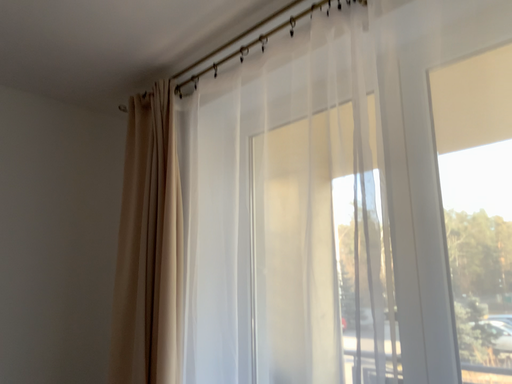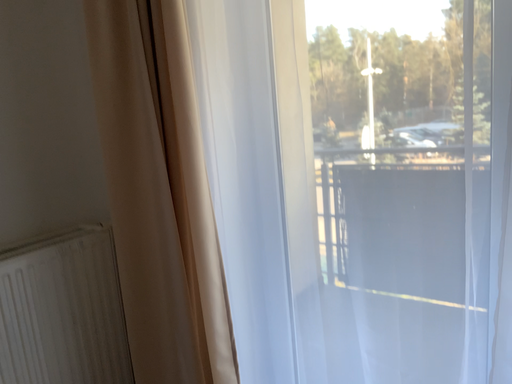
Question: How did the camera likely rotate when shooting the video?

Choices:
 (A) rotated upward
 (B) rotated downward

Answer: (B)